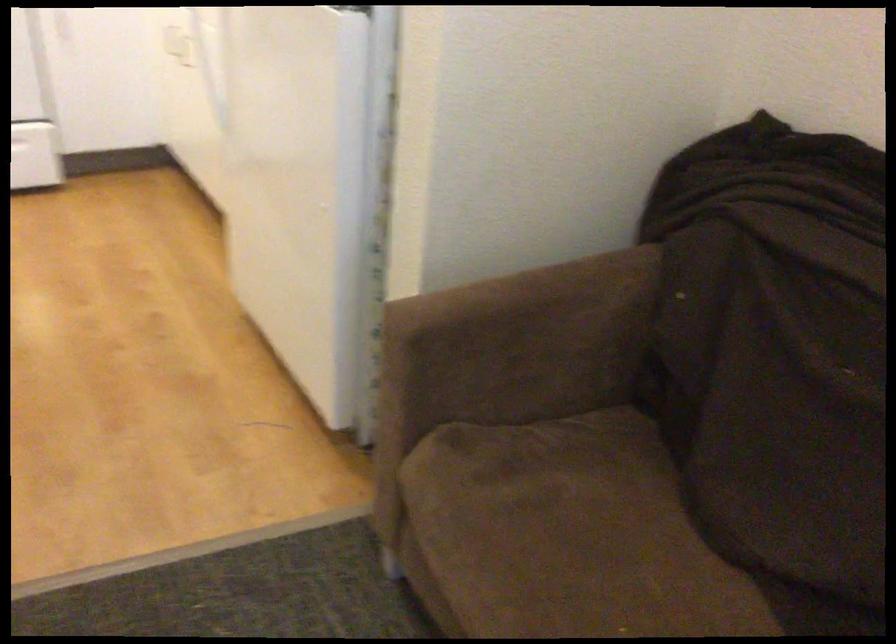
Describe the element at coordinates (533, 310) in the screenshot. I see `the brown sofa armrest` at that location.